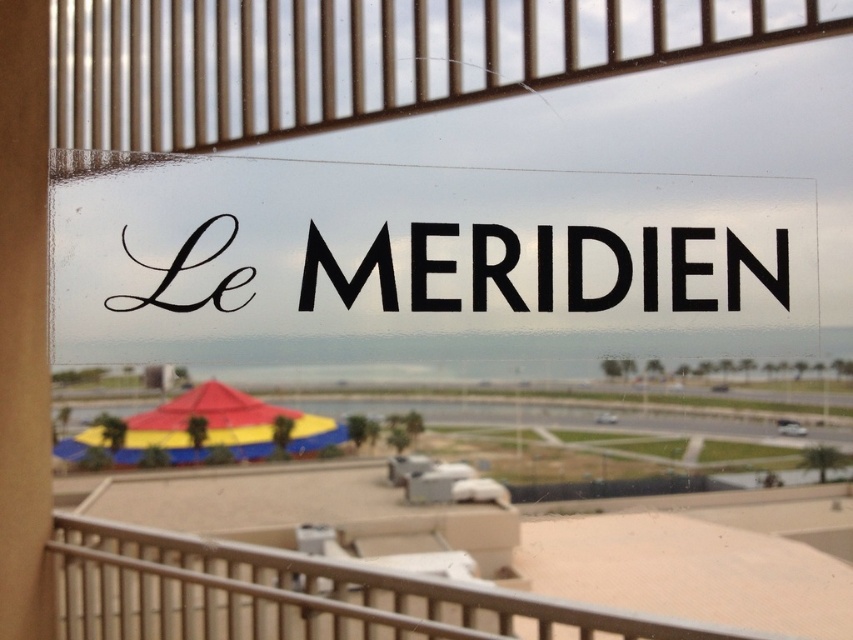
Who is shorter, black glossy sign at center or multicolored fabric umbrella at lower left?

With less height is multicolored fabric umbrella at lower left.

Is black glossy sign at center to the right of multicolored fabric umbrella at lower left from the viewer's perspective?

Indeed, black glossy sign at center is positioned on the right side of multicolored fabric umbrella at lower left.

Which is behind, point (402, 257) or point (235, 388)?

The point (402, 257) is behind.

This screenshot has height=640, width=853. Find the location of `black glossy sign at center`. black glossy sign at center is located at coordinates (430, 241).

Which is more to the left, metallic brown balustrade at upper center or multicolored fabric umbrella at lower left?

multicolored fabric umbrella at lower left is more to the left.

From the picture: Which is more to the right, metallic brown balustrade at upper center or multicolored fabric umbrella at lower left?

metallic brown balustrade at upper center

Between point (538, 4) and point (68, 436), which one is positioned behind?

Positioned behind is point (538, 4).

The width and height of the screenshot is (853, 640). Identify the location of metallic brown balustrade at upper center. pos(366,58).

Which of these two, metallic brown balustrade at upper center or metallic silver balustrade at center, stands shorter?

With less height is metallic silver balustrade at center.

Does metallic brown balustrade at upper center lie in front of metallic silver balustrade at center?

No, it is not.

Between point (422, 29) and point (120, 582), which one is positioned in front?

Positioned in front is point (120, 582).

Where is `metallic brown balustrade at upper center`? This screenshot has width=853, height=640. metallic brown balustrade at upper center is located at coordinates (366, 58).